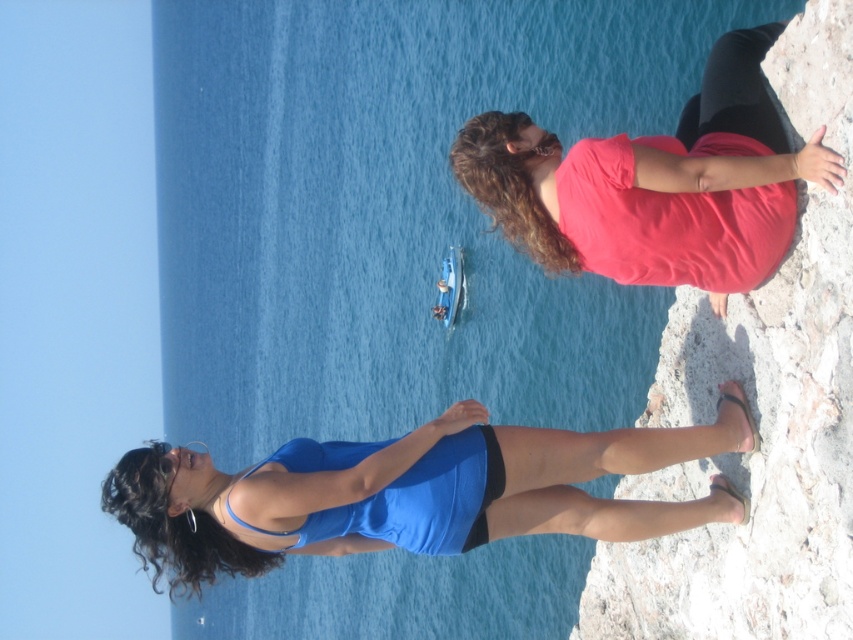
Is white rough stone at right below blue matte bikini top at lower center?

Yes, white rough stone at right is below blue matte bikini top at lower center.

Consider the image. Can you confirm if white rough stone at right is positioned to the right of blue matte bikini top at lower center?

Yes, white rough stone at right is to the right of blue matte bikini top at lower center.

Is point (619, 589) positioned before point (283, 536)?

No, it is behind (283, 536).

Find the location of a particular element. The width and height of the screenshot is (853, 640). white rough stone at right is located at coordinates (759, 412).

Is matte blue dress at lower center in front of matte pink shirt at upper right?

No.

Does point (248, 493) lie behind point (666, 152)?

Yes, it is behind point (666, 152).

You are a GUI agent. You are given a task and a screenshot of the screen. Output one action in this format:
    pyautogui.click(x=<x>, y=<y>)
    Task: Click on the matte blue dress at lower center
    
    Given the screenshot: What is the action you would take?
    pyautogui.click(x=413, y=492)

Does matte blue dress at lower center appear under blue matte bikini top at lower center?

Yes, matte blue dress at lower center is below blue matte bikini top at lower center.

Does matte blue dress at lower center have a greater height compared to blue matte bikini top at lower center?

Yes.

This screenshot has height=640, width=853. In order to click on matte blue dress at lower center in this screenshot , I will do `click(413, 492)`.

This screenshot has width=853, height=640. In order to click on matte blue dress at lower center in this screenshot , I will do click(413, 492).